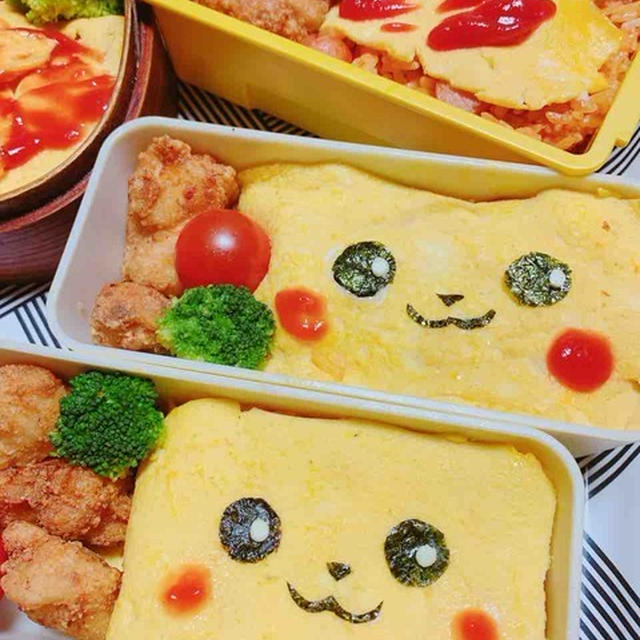
This screenshot has width=640, height=640. Find the location of `table cloth`. table cloth is located at coordinates (621, 534), (38, 324), (630, 160), (220, 112).